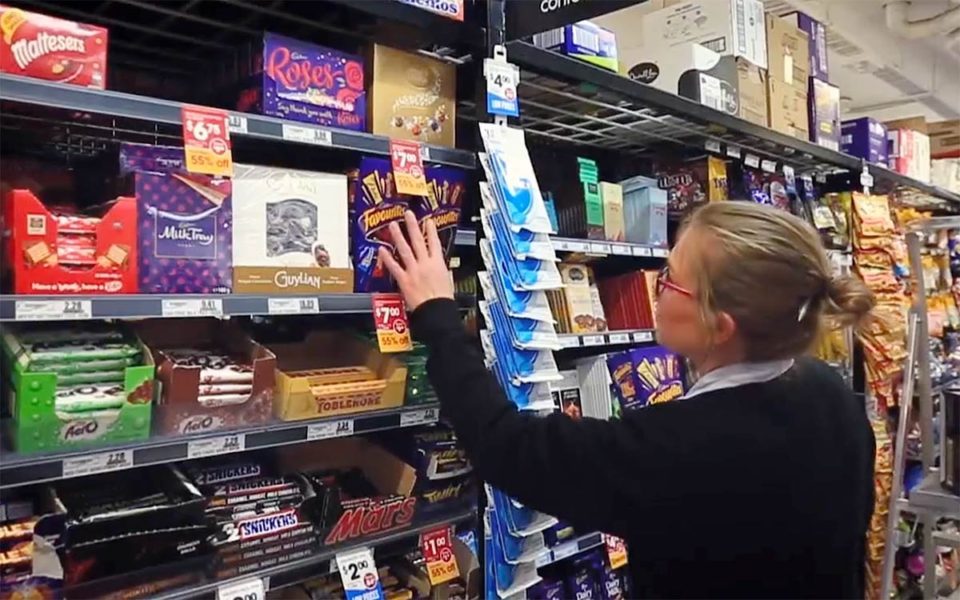
Where is `boxes above rack`? Image resolution: width=960 pixels, height=600 pixels. boxes above rack is located at coordinates (902, 140), (873, 140), (828, 120), (817, 44), (797, 60), (716, 46), (708, 78), (595, 46).